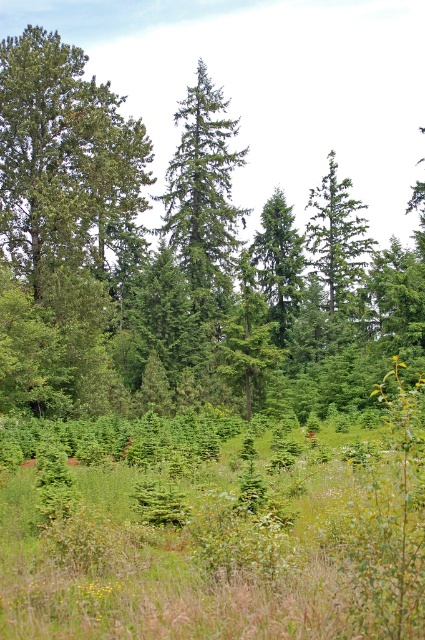
Can you confirm if green matte tree at upper right is thinner than green matte tree at center?

Yes, green matte tree at upper right is thinner than green matte tree at center.

Does green matte tree at upper right lie behind green matte tree at center?

No, green matte tree at upper right is closer to the viewer.

Identify the location of green matte tree at upper right. (337, 241).

Locate an element on the screen. green matte tree at upper right is located at coordinates (337, 241).

Which is in front, point (292, 228) or point (260, 260)?

Positioned in front is point (292, 228).

Can you confirm if green leafy tree at upper center is positioned above green matte tree at center?

Yes.

What do you see at coordinates (167, 257) in the screenshot? I see `green leafy tree at upper center` at bounding box center [167, 257].

At what (x,y) coordinates should I click in order to perform the action: click on green leafy tree at upper center. Please return your answer as a coordinate pair (x, y). This screenshot has width=425, height=640. Looking at the image, I should click on (167, 257).

Does green leafy tree at upper center come behind green matte tree at upper right?

No, green leafy tree at upper center is closer to the viewer.

Who is lower down, green leafy tree at upper center or green matte tree at upper right?

green matte tree at upper right is below.

The image size is (425, 640). What do you see at coordinates (167, 257) in the screenshot?
I see `green leafy tree at upper center` at bounding box center [167, 257].

The width and height of the screenshot is (425, 640). In order to click on green leafy tree at upper center in this screenshot , I will do `click(167, 257)`.